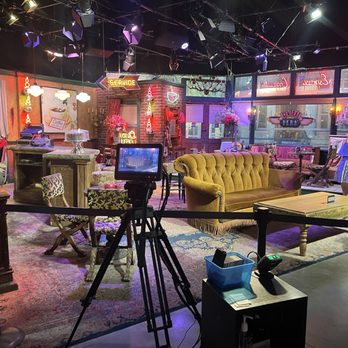
Identify the location of screen. (139, 162).